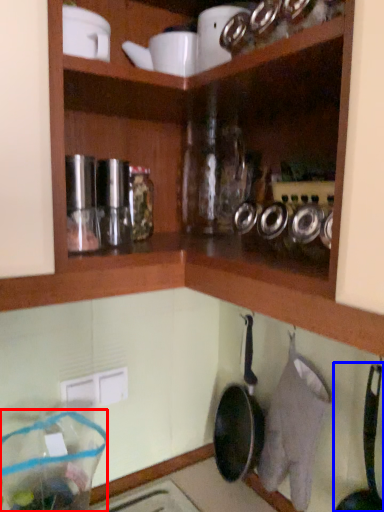
Question: Which of the following is the closest to the observer, glass jar (highlighted by a red box) or frying pan (highlighted by a blue box)?

Choices:
 (A) glass jar
 (B) frying pan

Answer: (B)